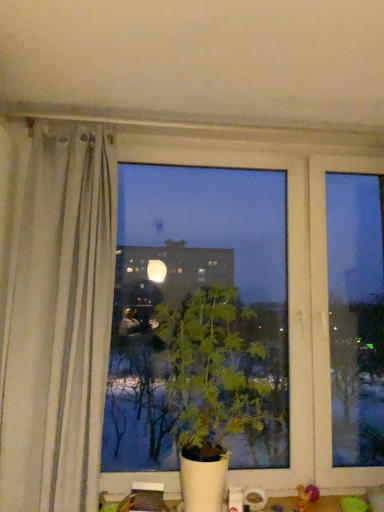
Question: From the image's perspective, is green fabric toy at lower right located above or below green leafy plant at center?

Choices:
 (A) above
 (B) below

Answer: (B)

Question: Do you think green fabric toy at lower right is within green leafy plant at center, or outside of it?

Choices:
 (A) inside
 (B) outside

Answer: (B)

Question: In terms of size, does green fabric toy at lower right appear bigger or smaller than green leafy plant at center?

Choices:
 (A) small
 (B) big

Answer: (A)

Question: Looking at their shapes, would you say green leafy plant at center is wider or thinner than green fabric toy at lower right?

Choices:
 (A) thin
 (B) wide

Answer: (B)

Question: Relative to green fabric toy at lower right, is green leafy plant at center in front or behind?

Choices:
 (A) front
 (B) behind

Answer: (A)

Question: From a real-world perspective, is green leafy plant at center above or below green fabric toy at lower right?

Choices:
 (A) below
 (B) above

Answer: (B)

Question: Is green leafy plant at center bigger or smaller than green fabric toy at lower right?

Choices:
 (A) small
 (B) big

Answer: (B)